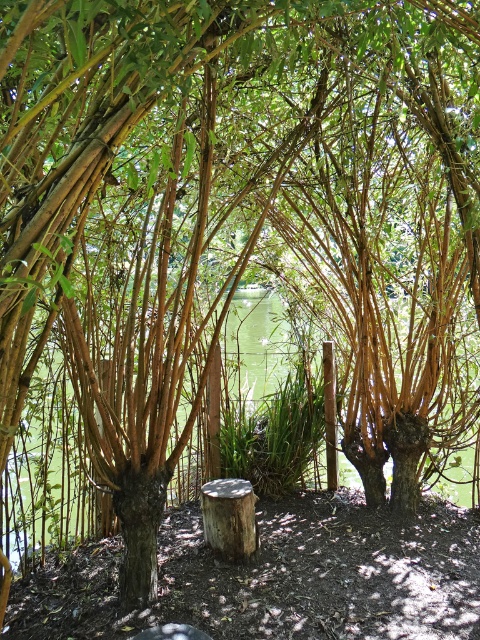
Consider the image. Is green liquid water at center thinner than light brown wood stump at center?

In fact, green liquid water at center might be wider than light brown wood stump at center.

Is green liquid water at center wider than light brown wood stump at center?

Indeed, green liquid water at center has a greater width compared to light brown wood stump at center.

Who is more distant from viewer, (x=193, y=472) or (x=208, y=508)?

Point (x=193, y=472)

You are a GUI agent. You are given a task and a screenshot of the screen. Output one action in this format:
    pyautogui.click(x=<x>, y=<y>)
    Task: Click on the green liquid water at center
    Image resolution: width=480 pixels, height=640 pixels.
    Given the screenshot: What is the action you would take?
    pyautogui.click(x=49, y=474)